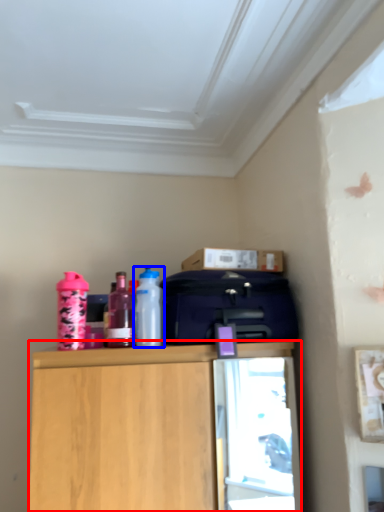
Question: Which object is closer to the camera taking this photo, cabinetry (highlighted by a red box) or bottle (highlighted by a blue box)?

Choices:
 (A) cabinetry
 (B) bottle

Answer: (A)